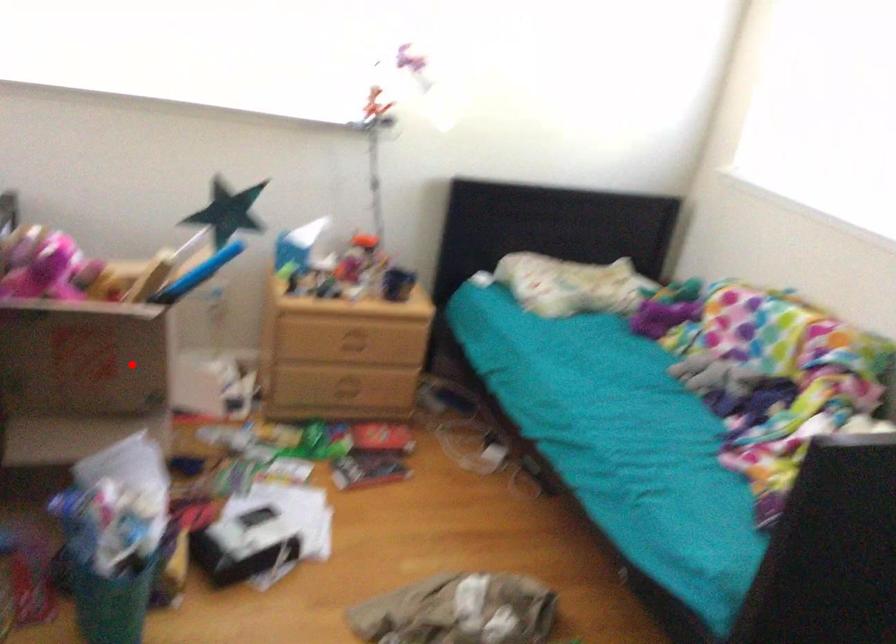
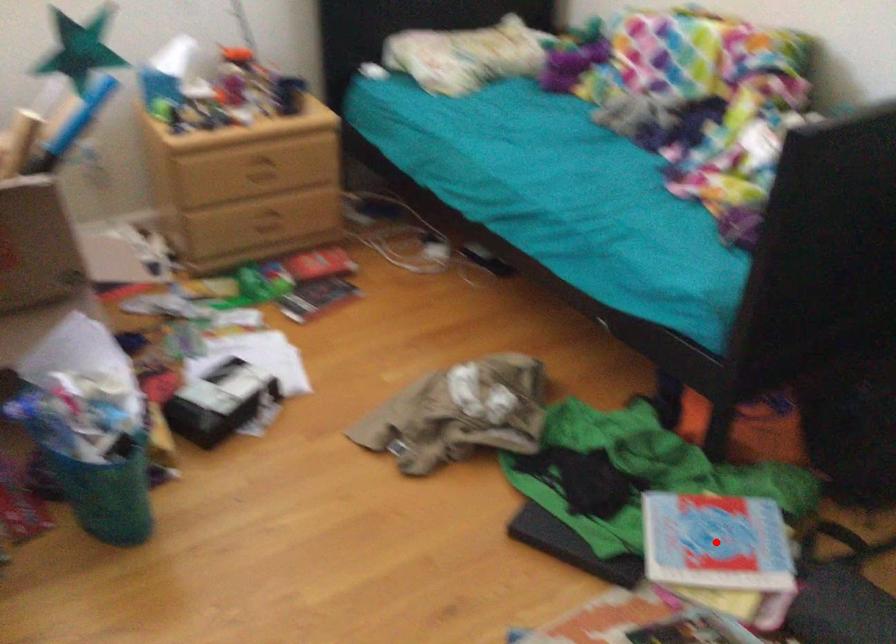
I am providing you with two images of the same scene from different viewpoints. A red point is marked on the first image and another point is marked on the second image. Does the point marked in image1 correspond to the same location as the one in image2?

No